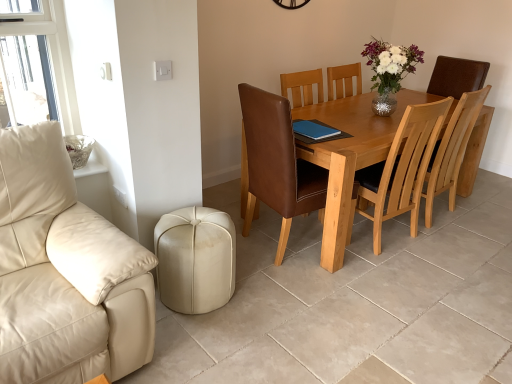
The width and height of the screenshot is (512, 384). Identify the location of brown leather chair at center, the 2th chair positioned from the right. (276, 164).

Where is `light brown wooden table at center`? light brown wooden table at center is located at coordinates (349, 158).

Describe the element at coordinates (314, 130) in the screenshot. Image resolution: width=512 pixels, height=384 pixels. I see `blue leather pad at center` at that location.

Locate an element on the screen. The height and width of the screenshot is (384, 512). light brown wood chair at center, acting as the 1th chair starting from the right is located at coordinates (453, 150).

Is blue leather pad at center situated inside brown leather chair at center, the first chair positioned from the left, or outside?

The correct answer is: inside.

Who is smaller, blue leather pad at center or brown leather chair at center, the 2th chair positioned from the right?

blue leather pad at center is smaller.

Which object is further away from the camera, blue leather pad at center or brown leather chair at center, the first chair positioned from the left?

blue leather pad at center is further away from the camera.

You are a GUI agent. You are given a task and a screenshot of the screen. Output one action in this format:
    pyautogui.click(x=<x>, y=<y>)
    Task: Click on the stool on the left of light brown wooden table at center
    
    Given the screenshot: What is the action you would take?
    pyautogui.click(x=195, y=259)

Are beige leather ottoman at lower left and light brown wooden table at center beside each other?

No, beige leather ottoman at lower left is not beside light brown wooden table at center.

Does beige leather ottoman at lower left have a lesser width compared to light brown wooden table at center?

Indeed, beige leather ottoman at lower left has a lesser width compared to light brown wooden table at center.

Which of these two, shiny silver vase at upper center or brown leather chair at center, the first chair positioned from the left, stands shorter?

shiny silver vase at upper center.

Find the location of a particular element. The height and width of the screenshot is (384, 512). floral arrangement on the right of brown leather chair at center, the 2th chair positioned from the right is located at coordinates (389, 71).

How different are the orientations of shiny silver vase at upper center and brown leather chair at center, the first chair positioned from the left, in degrees?

The facing directions of shiny silver vase at upper center and brown leather chair at center, the first chair positioned from the left, are 82.3 degrees apart.

How much distance is there between shiny silver vase at upper center and brown leather chair at center, the first chair positioned from the left?

94.13 centimeters.

From a real-world perspective, is light brown wood chair at center, acting as the 1th chair starting from the right, on top of shiny silver vase at upper center?

Actually, light brown wood chair at center, acting as the 1th chair starting from the right, is physically below shiny silver vase at upper center in the real world.

What's the angular difference between light brown wood chair at center, which ranks as the second chair in left-to-right order, and shiny silver vase at upper center's facing directions?

The angle between the facing direction of light brown wood chair at center, which ranks as the second chair in left-to-right order, and the facing direction of shiny silver vase at upper center is 180 degrees.

Locate an element on the screen. The image size is (512, 384). chair that appears on the right of shiny silver vase at upper center is located at coordinates (453, 150).

Which is more to the left, light brown wood chair at center, acting as the 1th chair starting from the right, or shiny silver vase at upper center?

shiny silver vase at upper center is more to the left.

From the image's perspective, between blue leather pad at center and beige leather ottoman at lower left, who is located below?

beige leather ottoman at lower left is shown below in the image.

Is blue leather pad at center thinner than beige leather ottoman at lower left?

Yes.

Measure the distance from blue leather pad at center to beige leather ottoman at lower left.

blue leather pad at center and beige leather ottoman at lower left are 38.16 inches apart.

Which object is positioned more to the right, blue leather pad at center or beige leather ottoman at lower left?

From the viewer's perspective, blue leather pad at center appears more on the right side.

Could you measure the distance between light brown wood chair at center, which ranks as the second chair in left-to-right order, and light brown wooden table at center?

light brown wood chair at center, which ranks as the second chair in left-to-right order, is 57.11 centimeters away from light brown wooden table at center.

Can you confirm if light brown wood chair at center, acting as the 1th chair starting from the right, is shorter than light brown wooden table at center?

No, light brown wood chair at center, acting as the 1th chair starting from the right, is not shorter than light brown wooden table at center.

Is light brown wood chair at center, which ranks as the second chair in left-to-right order, looking in the opposite direction of light brown wooden table at center?

Yes, light brown wood chair at center, which ranks as the second chair in left-to-right order, is facing away from light brown wooden table at center.

Looking at this image, how different are the orientations of brown leather chair at center, the first chair positioned from the left, and shiny silver vase at upper center in degrees?

82.3 degrees separate the facing orientations of brown leather chair at center, the first chair positioned from the left, and shiny silver vase at upper center.

Consider the image. Is brown leather chair at center, the 2th chair positioned from the right, beside shiny silver vase at upper center?

No, brown leather chair at center, the 2th chair positioned from the right, is not touching shiny silver vase at upper center.

Who is shorter, brown leather chair at center, the 2th chair positioned from the right, or shiny silver vase at upper center?

shiny silver vase at upper center is shorter.

From the image's perspective, is brown leather chair at center, the first chair positioned from the left, below shiny silver vase at upper center?

Yes.

Find the location of a particular element. chair in front of the blue leather pad at center is located at coordinates (276, 164).

Locate an element on the screen. kitchen & dining room table above the beige leather ottoman at lower left (from a real-world perspective) is located at coordinates (349, 158).

Looking at the image, which one is located closer to beige leather ottoman at lower left, brown leather chair at center, the 2th chair positioned from the right, or light brown wooden table at center?

brown leather chair at center, the 2th chair positioned from the right, is closer to beige leather ottoman at lower left.

Looking at the image, which one is located further to shiny silver vase at upper center, brown leather chair at center, the first chair positioned from the left, or light brown wooden table at center?

brown leather chair at center, the first chair positioned from the left, is positioned further to the anchor shiny silver vase at upper center.

Looking at the image, which one is located further to light brown wooden table at center, beige leather ottoman at lower left or shiny silver vase at upper center?

beige leather ottoman at lower left is further to light brown wooden table at center.

From the image, which object appears to be farther from brown leather chair at center, the first chair positioned from the left, light brown wood chair at center, acting as the 1th chair starting from the right, or blue leather pad at center?

light brown wood chair at center, acting as the 1th chair starting from the right.

Which object lies nearer to the anchor point beige leather ottoman at lower left, blue leather pad at center or brown leather chair at center, the first chair positioned from the left?

brown leather chair at center, the first chair positioned from the left, is closer to beige leather ottoman at lower left.

Looking at the image, which one is located further to blue leather pad at center, beige leather ottoman at lower left or light brown wood chair at center, which ranks as the second chair in left-to-right order?

light brown wood chair at center, which ranks as the second chair in left-to-right order, lies further to blue leather pad at center than the other object.

Looking at the image, which one is located closer to light brown wood chair at center, acting as the 1th chair starting from the right, shiny silver vase at upper center or brown leather chair at center, the first chair positioned from the left?

Among the two, shiny silver vase at upper center is located nearer to light brown wood chair at center, acting as the 1th chair starting from the right.

Based on their spatial positions, is beige leather ottoman at lower left or light brown wooden table at center further from shiny silver vase at upper center?

beige leather ottoman at lower left.

Identify the location of chair situated between beige leather ottoman at lower left and shiny silver vase at upper center from left to right. click(x=276, y=164).

You are a GUI agent. You are given a task and a screenshot of the screen. Output one action in this format:
    pyautogui.click(x=<x>, y=<y>)
    Task: Click on the kitchen & dining room table between blue leather pad at center and shiny silver vase at upper center
    The height and width of the screenshot is (384, 512).
    Given the screenshot: What is the action you would take?
    pyautogui.click(x=349, y=158)

Where is `pad between brown leather chair at center, the 2th chair positioned from the right, and light brown wooden table at center`? pad between brown leather chair at center, the 2th chair positioned from the right, and light brown wooden table at center is located at coordinates (314, 130).

The image size is (512, 384). Find the location of `floral arrangement between brown leather chair at center, the first chair positioned from the left, and light brown wood chair at center, which ranks as the second chair in left-to-right order, in the horizontal direction`. floral arrangement between brown leather chair at center, the first chair positioned from the left, and light brown wood chair at center, which ranks as the second chair in left-to-right order, in the horizontal direction is located at coordinates (389, 71).